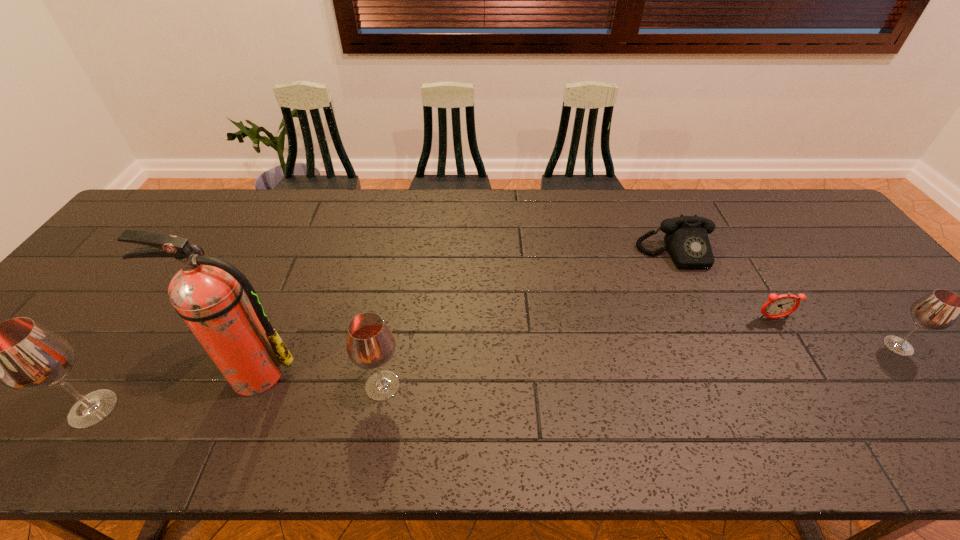
You are a GUI agent. You are given a task and a screenshot of the screen. Output one action in this format:
    pyautogui.click(x=<x>, y=<y>)
    Task: Click on the free spot between the fire extinguisher and the shortest wineglass
    The image size is (960, 540).
    Given the screenshot: What is the action you would take?
    pyautogui.click(x=576, y=360)

I want to click on free space between the shortest wineglass and the second shortest wineglass, so click(x=640, y=366).

This screenshot has height=540, width=960. What are the coordinates of `free space that is in between the rightmost wineglass and the alarm clock` in the screenshot? It's located at [x=835, y=332].

Identify the location of the second closest object relative to the fire extinguisher. This screenshot has width=960, height=540. (21, 354).

The image size is (960, 540). In order to click on object identified as the closest to the second wineglass from left to right in this screenshot , I will do `click(207, 292)`.

Identify which wineglass is the second nearest to the tallest object. Please provide its 2D coordinates. Your answer should be formatted as a tuple, i.e. [(x, y)], where the tuple contains the x and y coordinates of a point satisfying the conditions above.

[(21, 354)]

Locate an element on the screen. wineglass that is the second closest to the third object from right to left is located at coordinates (370, 344).

The height and width of the screenshot is (540, 960). I want to click on vacant space that satisfies the following two spatial constraints: 1. on the back side of the fifth shortest object; 2. on the right side of the second shortest wineglass, so click(108, 386).

In order to click on free space that satisfies the following two spatial constraints: 1. on the front-facing side of the rightmost object; 2. on the right side of the second farthest object in this screenshot , I will do `click(789, 346)`.

Where is `vacant area that satisfies the following two spatial constraints: 1. on the dial of the telephone; 2. on the left side of the rightmost object`? The height and width of the screenshot is (540, 960). vacant area that satisfies the following two spatial constraints: 1. on the dial of the telephone; 2. on the left side of the rightmost object is located at coordinates (718, 346).